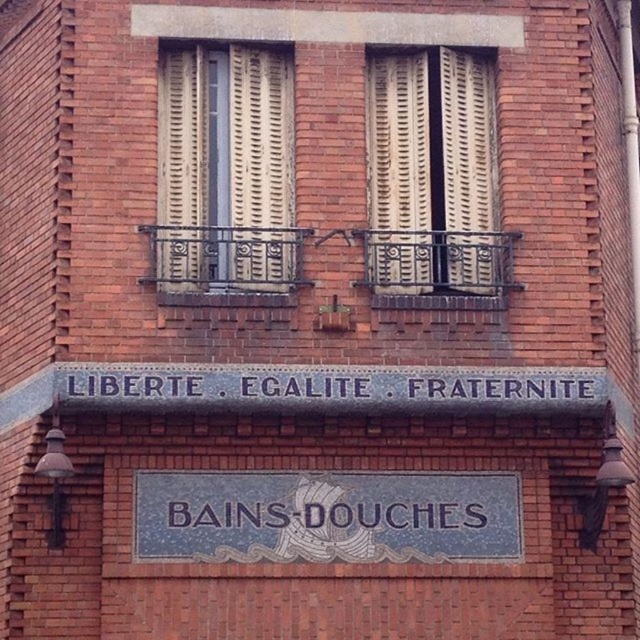
Question: Which of the following is the closest to the observer?

Choices:
 (A) blue mosaic sign at center
 (B) iron textured balcony at center
 (C) black wrought iron balcony at center

Answer: (C)

Question: Which point is closer to the camera taking this photo?

Choices:
 (A) (500, 552)
 (B) (266, 230)
 (C) (451, 284)
 (D) (108, 365)

Answer: (D)

Question: Considering the real-world distances, which object is closest to the iron textured balcony at center?

Choices:
 (A) black wrought iron balcony at center
 (B) blue mosaic sign at center

Answer: (A)

Question: Can you confirm if iron textured balcony at center is thinner than black wrought iron balcony at center?

Choices:
 (A) yes
 (B) no

Answer: (A)

Question: Is blue mosaic sign at center further to camera compared to gray stone sign at center?

Choices:
 (A) yes
 (B) no

Answer: (A)

Question: Does blue mosaic sign at center lie in front of gray stone sign at center?

Choices:
 (A) no
 (B) yes

Answer: (A)